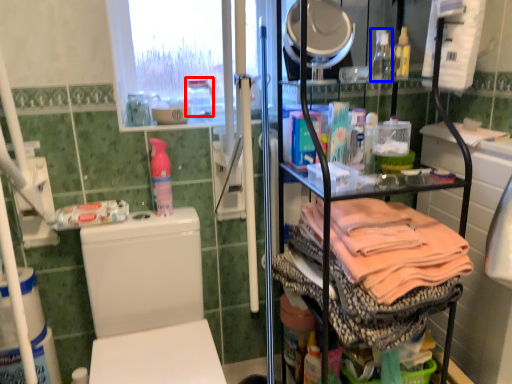
Question: Which point is further to the camera, bottle (highlighted by a red box) or bottle (highlighted by a blue box)?

Choices:
 (A) bottle
 (B) bottle

Answer: (A)